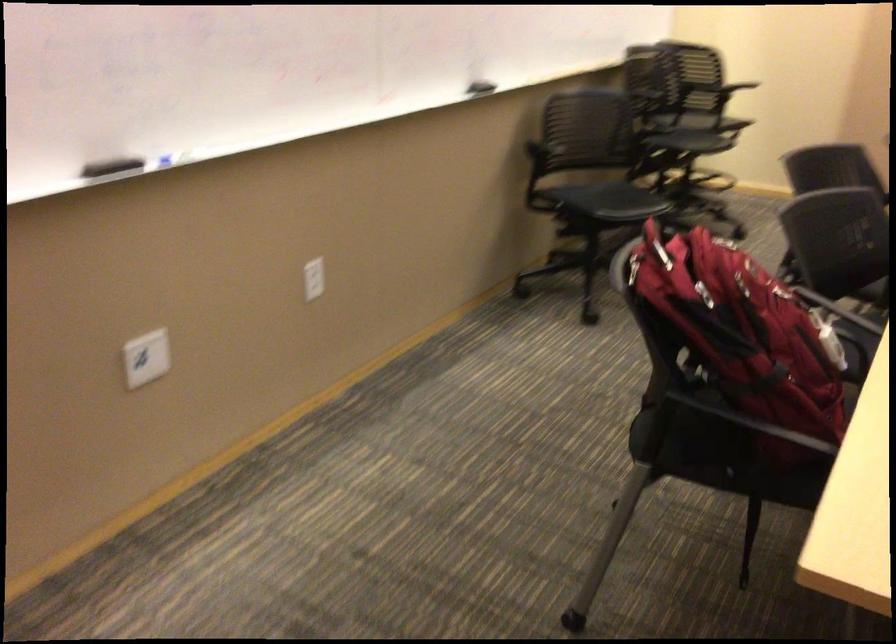
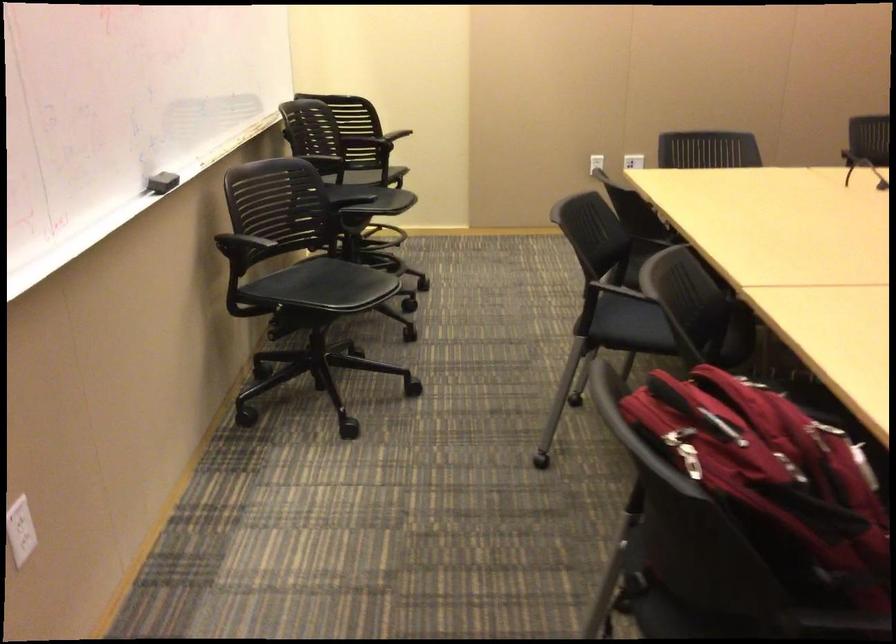
Find the pixel in the second image that matches (x=664, y=272) in the first image.

(690, 460)